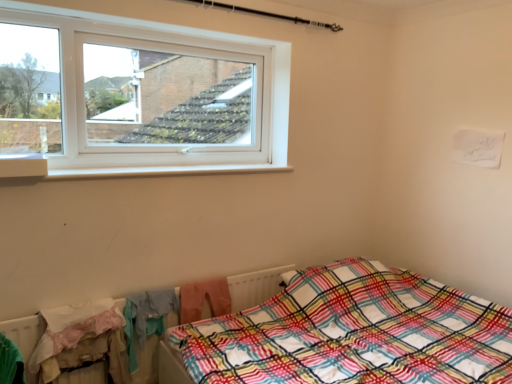
Question: Is white textured radiator at lower left facing towards white plastic window sill at upper left?

Choices:
 (A) yes
 (B) no

Answer: (B)

Question: Is the depth of white textured radiator at lower left greater than that of white plastic window sill at upper left?

Choices:
 (A) yes
 (B) no

Answer: (A)

Question: Considering the relative sizes of white textured radiator at lower left and white plastic window sill at upper left in the image provided, is white textured radiator at lower left bigger than white plastic window sill at upper left?

Choices:
 (A) no
 (B) yes

Answer: (B)

Question: Does white textured radiator at lower left lie in front of white plastic window sill at upper left?

Choices:
 (A) yes
 (B) no

Answer: (B)

Question: Considering the relative sizes of white textured radiator at lower left and white plastic window sill at upper left in the image provided, is white textured radiator at lower left shorter than white plastic window sill at upper left?

Choices:
 (A) no
 (B) yes

Answer: (A)

Question: Is white textured radiator at lower left touching white plastic window sill at upper left?

Choices:
 (A) yes
 (B) no

Answer: (B)

Question: Can you confirm if plaid fabric bed at lower right is positioned to the left of white textured radiator at lower left?

Choices:
 (A) no
 (B) yes

Answer: (A)

Question: Is plaid fabric bed at lower right not inside white textured radiator at lower left?

Choices:
 (A) yes
 (B) no

Answer: (A)

Question: From a real-world perspective, is plaid fabric bed at lower right positioned under white textured radiator at lower left based on gravity?

Choices:
 (A) yes
 (B) no

Answer: (A)

Question: Is plaid fabric bed at lower right oriented away from white textured radiator at lower left?

Choices:
 (A) no
 (B) yes

Answer: (A)

Question: Does plaid fabric bed at lower right appear on the right side of white textured radiator at lower left?

Choices:
 (A) no
 (B) yes

Answer: (B)

Question: Would you say plaid fabric bed at lower right is a long distance from white textured radiator at lower left?

Choices:
 (A) no
 (B) yes

Answer: (A)

Question: Considering the relative sizes of white textured radiator at lower left and plaid fabric bed at lower right in the image provided, is white textured radiator at lower left smaller than plaid fabric bed at lower right?

Choices:
 (A) yes
 (B) no

Answer: (A)